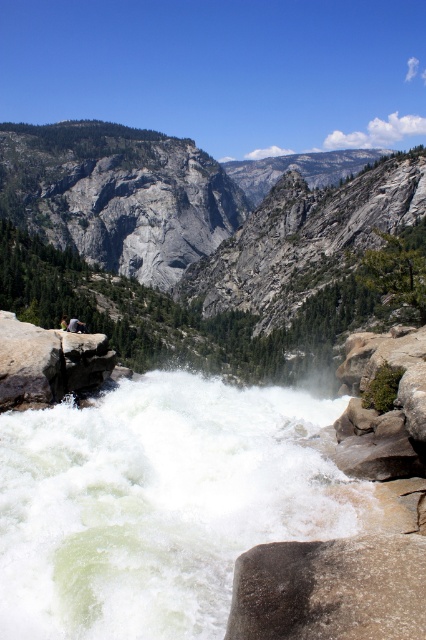
Question: Which point is closer to the camera taking this photo?

Choices:
 (A) (339, 508)
 (B) (19, 141)

Answer: (A)

Question: Does gray rock mountain at upper center appear on the left side of light brown leather jacket at center?

Choices:
 (A) no
 (B) yes

Answer: (B)

Question: Can you confirm if gray rock mountain at upper center is wider than light brown leather jacket at center?

Choices:
 (A) no
 (B) yes

Answer: (B)

Question: Among these points, which one is nearest to the camera?

Choices:
 (A) (406, 580)
 (B) (207, 637)
 (C) (85, 326)

Answer: (A)

Question: Is gray rock mountain at upper center to the left of white frothy water at center from the viewer's perspective?

Choices:
 (A) yes
 (B) no

Answer: (A)

Question: Which is nearer to the gray rough rock at lower center?

Choices:
 (A) gray rock at center
 (B) gray rock mountain at upper center

Answer: (A)